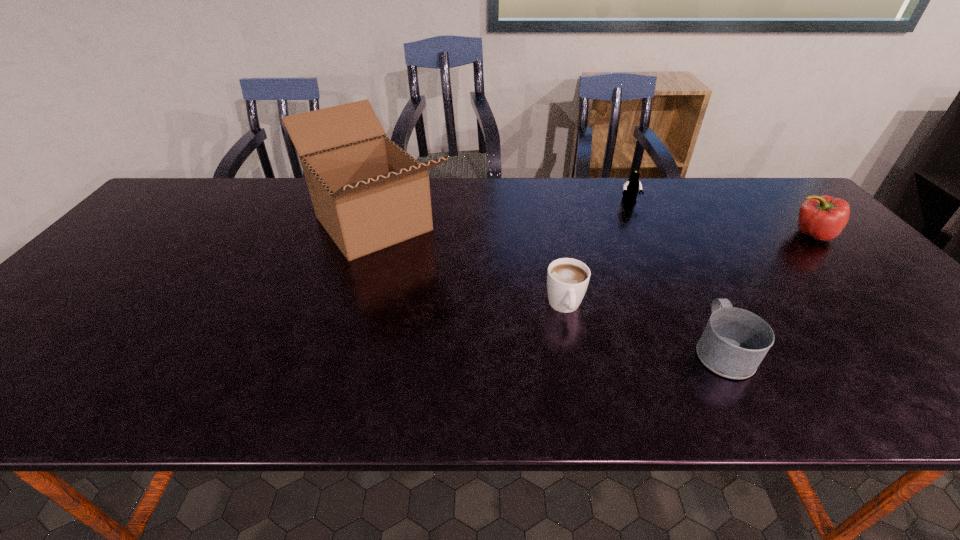
In order to click on the leftmost object in this screenshot , I will do `click(368, 193)`.

Where is `box`? box is located at coordinates click(368, 193).

Where is `bell pepper`? This screenshot has height=540, width=960. bell pepper is located at coordinates (823, 217).

Locate an element on the screen. Lego is located at coordinates (631, 187).

I want to click on cappuccino, so click(x=567, y=279).

Find the location of a particular element. Image resolution: width=960 pixels, height=540 pixels. mug is located at coordinates (734, 342).

I want to click on free space located on the left of the leftmost object, so (x=177, y=224).

Image resolution: width=960 pixels, height=540 pixels. I want to click on free space located on the back of the bell pepper, so click(x=759, y=180).

Locate an element on the screen. The image size is (960, 540). blank space located on the front-facing side of the Lego is located at coordinates pyautogui.click(x=636, y=216).

Locate an element on the screen. This screenshot has width=960, height=540. vacant area located 0.080m with the handle on the side of the cappuccino is located at coordinates (574, 354).